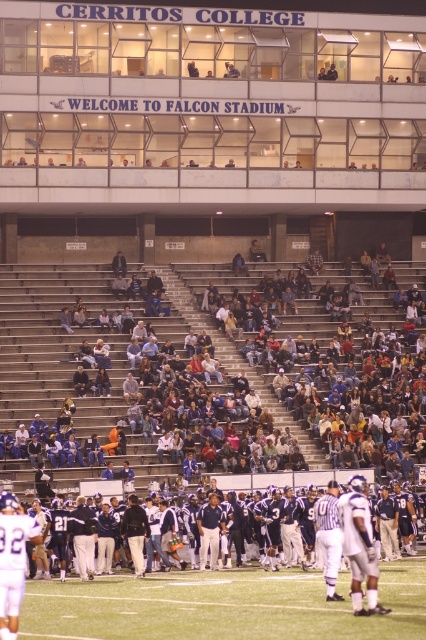
Question: Which object appears closest to the camera in this image?

Choices:
 (A) green turf football field at center
 (B) dark blue uniform at center

Answer: (B)

Question: In this image, where is dark blue uniform at center located relative to green turf football field at center?

Choices:
 (A) above
 (B) below

Answer: (B)

Question: Observing the image, what is the correct spatial positioning of dark blue uniform at center in reference to green turf football field at center?

Choices:
 (A) left
 (B) right

Answer: (A)

Question: Which point is farther to the camera?

Choices:
 (A) dark blue uniform at center
 (B) green turf football field at center

Answer: (B)

Question: Where is dark blue uniform at center located in relation to green turf football field at center in the image?

Choices:
 (A) below
 (B) above

Answer: (A)

Question: Which point appears farthest from the camera in this image?

Choices:
 (A) (302, 637)
 (B) (344, 582)

Answer: (B)